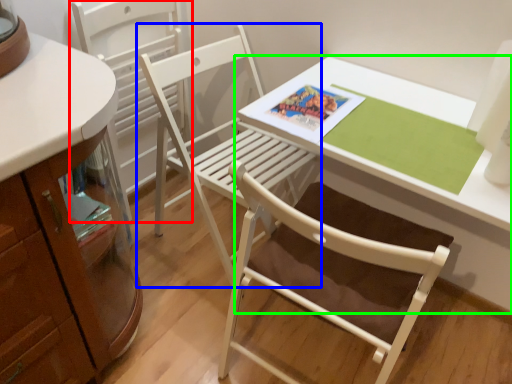
Question: Considering the real-world distances, which object is closest to chair (highlighted by a red box)? chair (highlighted by a blue box) or table (highlighted by a green box).

Choices:
 (A) chair
 (B) table

Answer: (A)